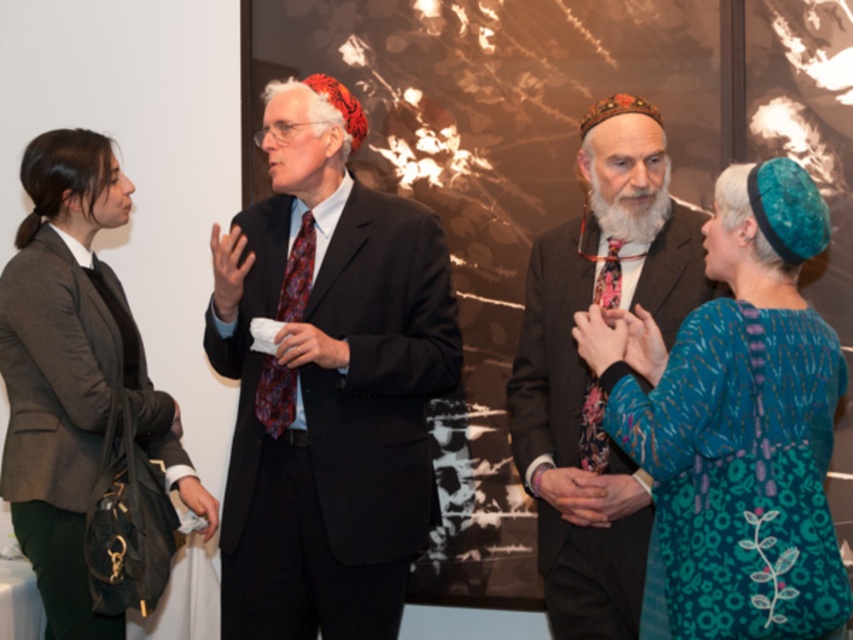
Question: Which object appears farthest from the camera in this image?

Choices:
 (A) teal floral dress at center
 (B) brown textured suit at center

Answer: (B)

Question: Is matte black suit at center behind dark gray fabric blazer at left?

Choices:
 (A) no
 (B) yes

Answer: (A)

Question: Does matte black suit at center appear on the right side of dark gray fabric blazer at left?

Choices:
 (A) no
 (B) yes

Answer: (B)

Question: Is the position of matte black suit at center less distant than that of teal floral dress at center?

Choices:
 (A) no
 (B) yes

Answer: (A)

Question: Which object is closer to the camera taking this photo?

Choices:
 (A) dark gray fabric blazer at left
 (B) brown textured suit at center
 (C) white soft beard at center

Answer: (B)

Question: Which of these objects is positioned closest to the matte black suit at center?

Choices:
 (A) teal floral dress at center
 (B) dark gray fabric blazer at left
 (C) white soft beard at center
 (D) brown textured suit at center

Answer: (B)